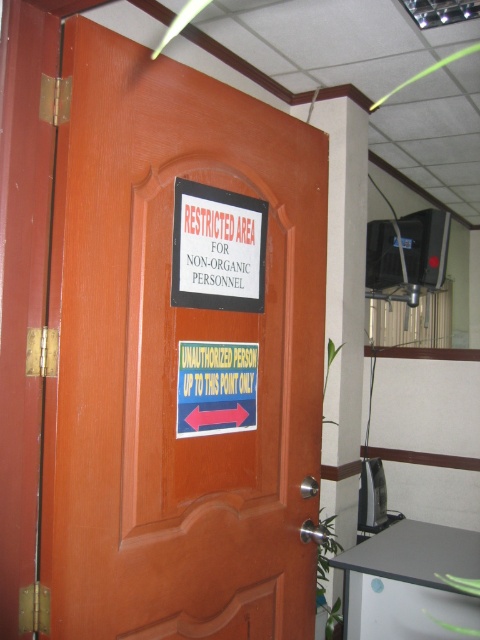
You are an architect designing a new building and need to ensure that all doors are wider than their attached signs. Based on the image provided, does the brown wooden door at center meet this requirement compared to the white paper sign at center?

The brown wooden door at center is wider than the white paper sign at center, so it meets the requirement.

From the picture: You are standing in front of the brown wooden door at center and notice the white paper sign at center. Based on their positions, which object is higher up?

The white paper sign at center is higher up since the brown wooden door at center is located below it.